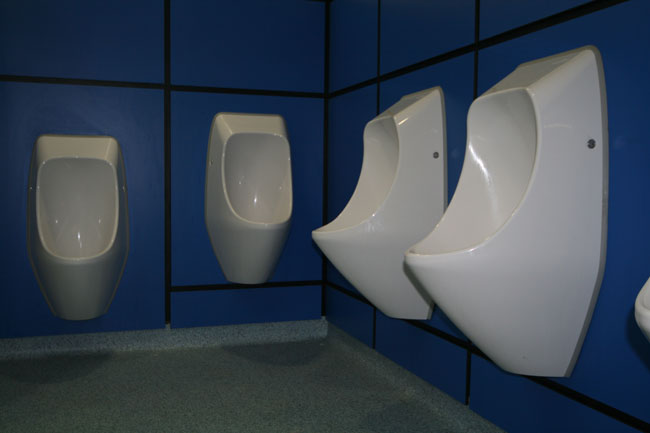
Where is `bottom of urinal`? The height and width of the screenshot is (433, 650). bottom of urinal is located at coordinates (84, 320), (244, 286), (391, 319), (514, 374).